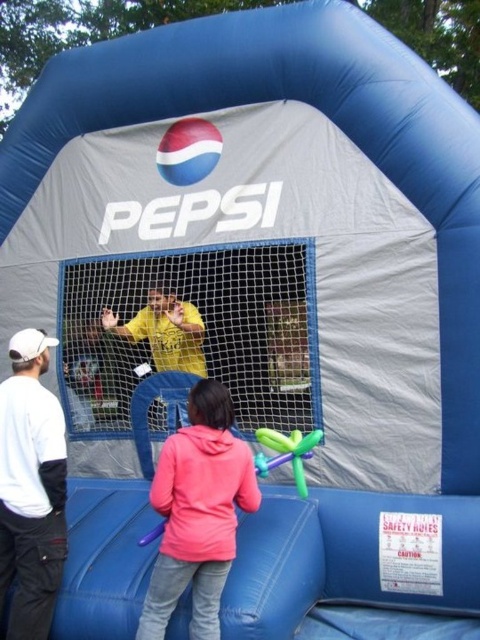
What is the color of the clothing worn by the person at the point marked by coordinates [203,492]?

The person at the point marked by coordinates [203,492] is wearing a pink fleece sweatshirt.

You are standing in front of the Pepsi inflatable structure and want to know which of the two points, point (228, 502) or point (288, 454), is closer to you. Can you determine this based on their positions?

Point (228, 502) is closer to the camera than point (288, 454), so it is closer to you.